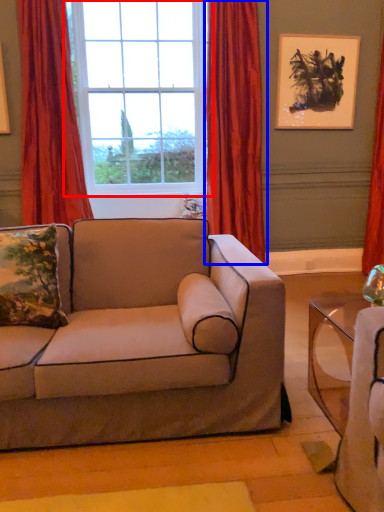
Question: Among these objects, which one is nearest to the camera, window (highlighted by a red box) or curtain (highlighted by a blue box)?

Choices:
 (A) window
 (B) curtain

Answer: (B)